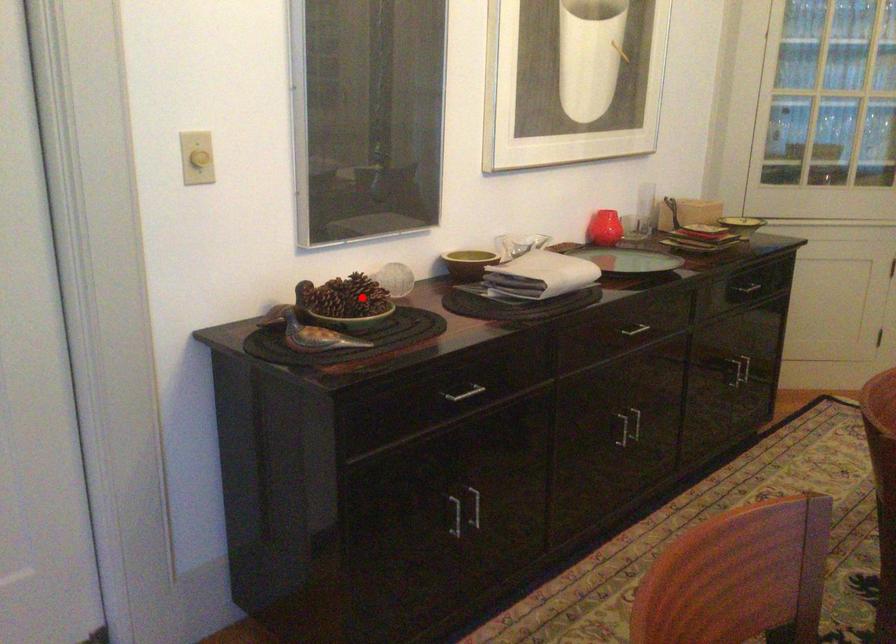
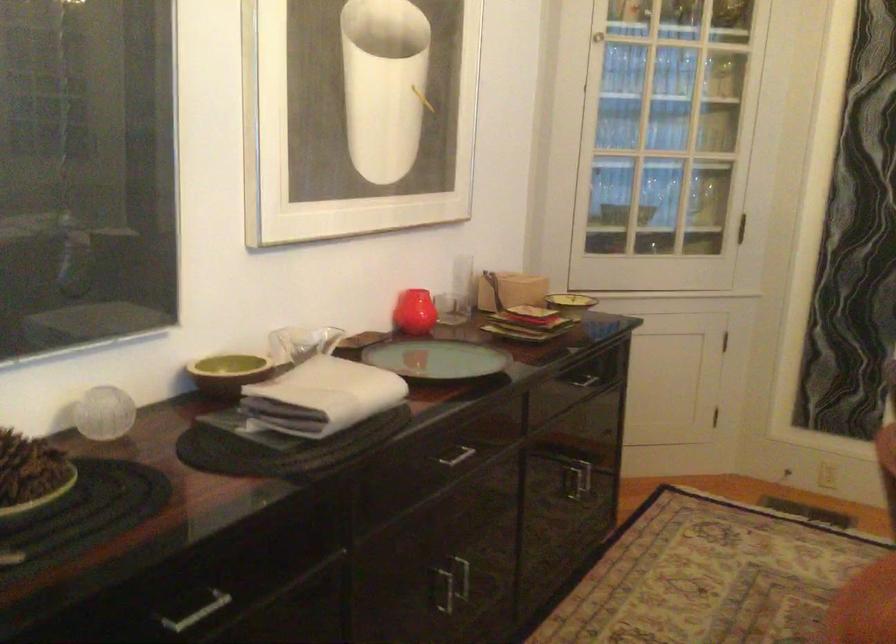
Where in the second image is the point corresponding to the highlighted location from the first image?

(30, 475)